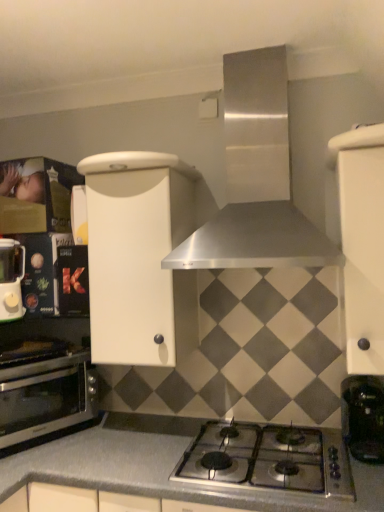
Question: Does stainless steel oven at lower left have a lesser width compared to stainless steel range hood at upper center?

Choices:
 (A) yes
 (B) no

Answer: (A)

Question: Can you confirm if stainless steel oven at lower left is positioned to the right of stainless steel range hood at upper center?

Choices:
 (A) yes
 (B) no

Answer: (B)

Question: From the image's perspective, would you say stainless steel oven at lower left is positioned over stainless steel range hood at upper center?

Choices:
 (A) no
 (B) yes

Answer: (A)

Question: From a real-world perspective, does stainless steel oven at lower left sit lower than stainless steel range hood at upper center?

Choices:
 (A) yes
 (B) no

Answer: (A)

Question: From the image's perspective, does stainless steel oven at lower left appear lower than stainless steel range hood at upper center?

Choices:
 (A) no
 (B) yes

Answer: (B)

Question: Choose the correct answer: Is white matte cabinet at right, which ranks as the first cabinetry in right-to-left order, inside stainless steel range hood at upper center or outside it?

Choices:
 (A) outside
 (B) inside

Answer: (A)

Question: From a real-world perspective, is white matte cabinet at right, which is counted as the 2th cabinetry, starting from the left, physically located above or below stainless steel range hood at upper center?

Choices:
 (A) above
 (B) below

Answer: (B)

Question: From the image's perspective, is white matte cabinet at right, which ranks as the first cabinetry in right-to-left order, above or below stainless steel range hood at upper center?

Choices:
 (A) above
 (B) below

Answer: (B)

Question: Considering their positions, is white matte cabinet at right, which is counted as the 2th cabinetry, starting from the left, located in front of or behind stainless steel range hood at upper center?

Choices:
 (A) front
 (B) behind

Answer: (A)

Question: In the image, is white matte cabinet at center, which is counted as the first cabinetry, starting from the left, on the left side or the right side of black plastic coffee machine at lower right?

Choices:
 (A) left
 (B) right

Answer: (A)

Question: Considering their positions, is white matte cabinet at center, acting as the 2th cabinetry starting from the right, located in front of or behind black plastic coffee machine at lower right?

Choices:
 (A) behind
 (B) front

Answer: (A)

Question: Considering the positions of white matte cabinet at center, which is counted as the first cabinetry, starting from the left, and black plastic coffee machine at lower right in the image, is white matte cabinet at center, which is counted as the first cabinetry, starting from the left, taller or shorter than black plastic coffee machine at lower right?

Choices:
 (A) short
 (B) tall

Answer: (B)

Question: Considering the positions of point (168, 251) and point (375, 435), is point (168, 251) closer or farther from the camera than point (375, 435)?

Choices:
 (A) closer
 (B) farther

Answer: (B)

Question: Is stainless steel range hood at upper center wider or thinner than black plastic coffee machine at lower right?

Choices:
 (A) wide
 (B) thin

Answer: (A)

Question: From a real-world perspective, is stainless steel range hood at upper center positioned above or below black plastic coffee machine at lower right?

Choices:
 (A) above
 (B) below

Answer: (A)